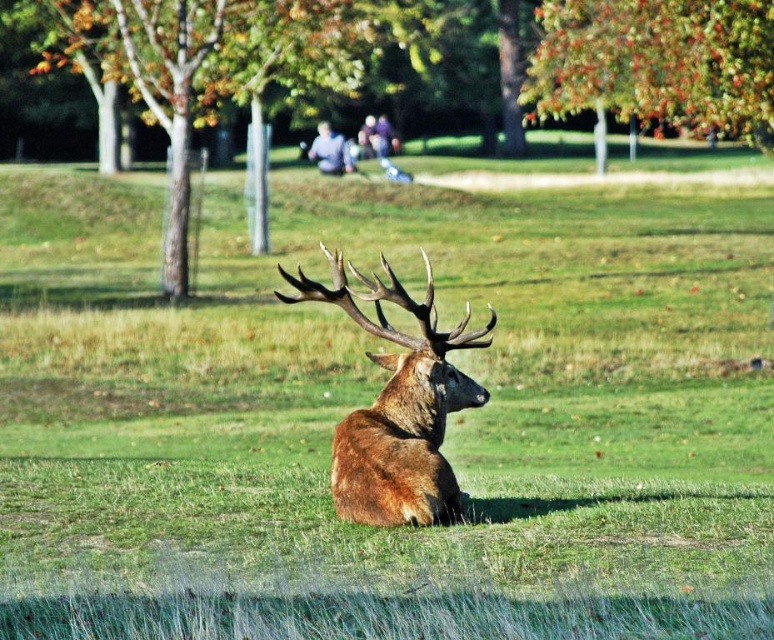
Is green leafy tree at upper center to the left of brown velvet deer at center from the viewer's perspective?

In fact, green leafy tree at upper center is to the right of brown velvet deer at center.

Is point (625, 44) positioned behind point (413, 520)?

Yes.

I want to click on green leafy tree at upper center, so tap(658, 61).